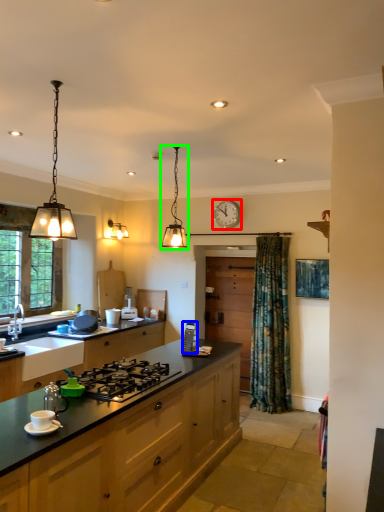
Question: Estimate the real-world distances between objects in this image. Which object is farther from clock (highlighted by a red box), appliance (highlighted by a blue box) or light fixture (highlighted by a green box)?

Choices:
 (A) appliance
 (B) light fixture

Answer: (B)